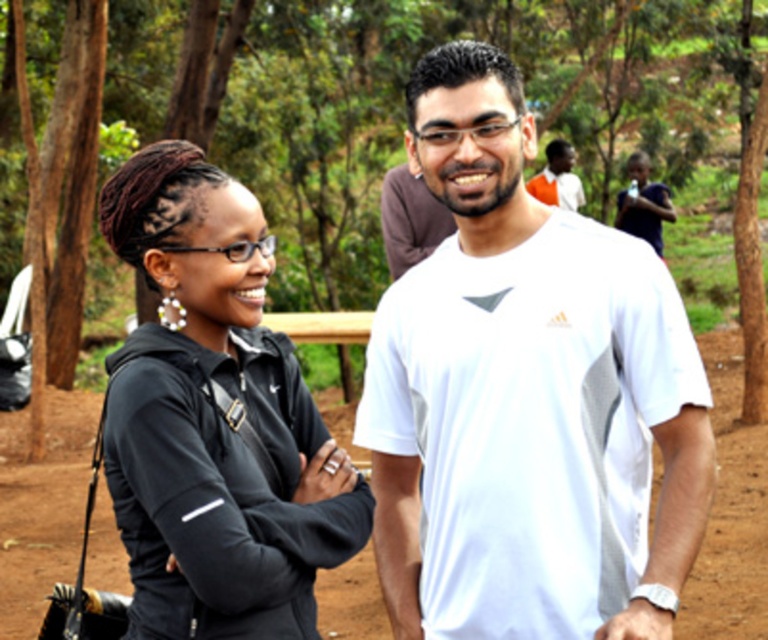
You are a photographer setting up a shot in a park. You need to position two subjects so that one is on the left and the other on the right. The subjects are wearing a black matte jacket at center and an orange cotton shirt at upper right. Based on their current positions, which subject should you ask to move to the right side of the frame?

The orange cotton shirt at upper right should move to the right side since the black matte jacket at center is already positioned to its left.